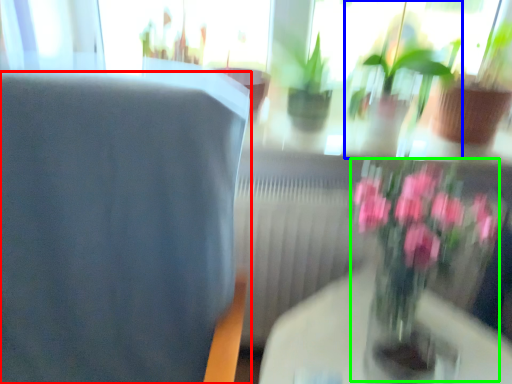
Question: Which object is the closest to the chair (highlighted by a red box)? Choose among these: houseplant (highlighted by a blue box) or floral arrangement (highlighted by a green box).

Choices:
 (A) houseplant
 (B) floral arrangement

Answer: (B)